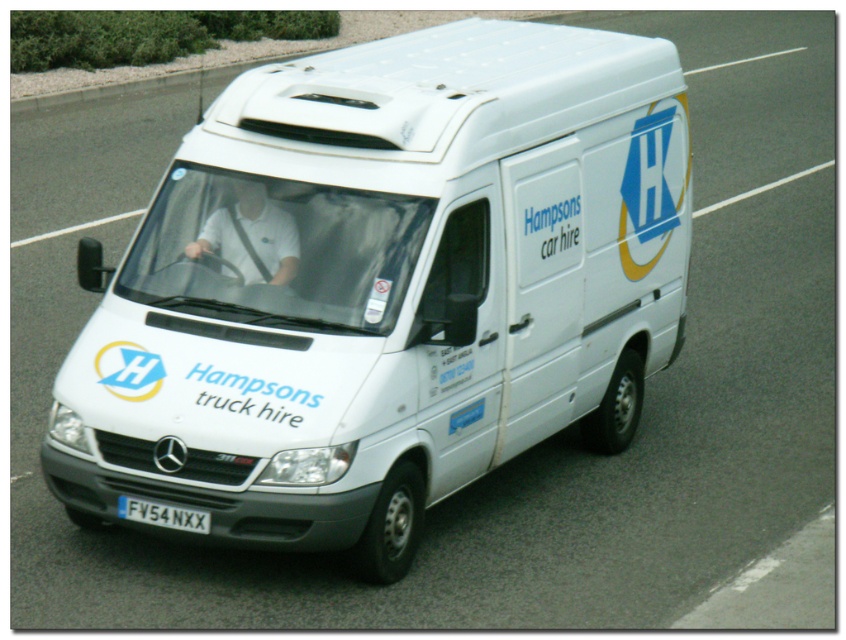
Consider the image. Who is positioned more to the right, white matte van at center or white plastic license plate at center?

white matte van at center is more to the right.

Between white matte van at center and white plastic license plate at center, which one has less height?

white plastic license plate at center is shorter.

Which is behind, point (563, 45) or point (171, 515)?

The point (563, 45) is more distant.

Locate an element on the screen. Image resolution: width=846 pixels, height=640 pixels. white matte van at center is located at coordinates (383, 285).